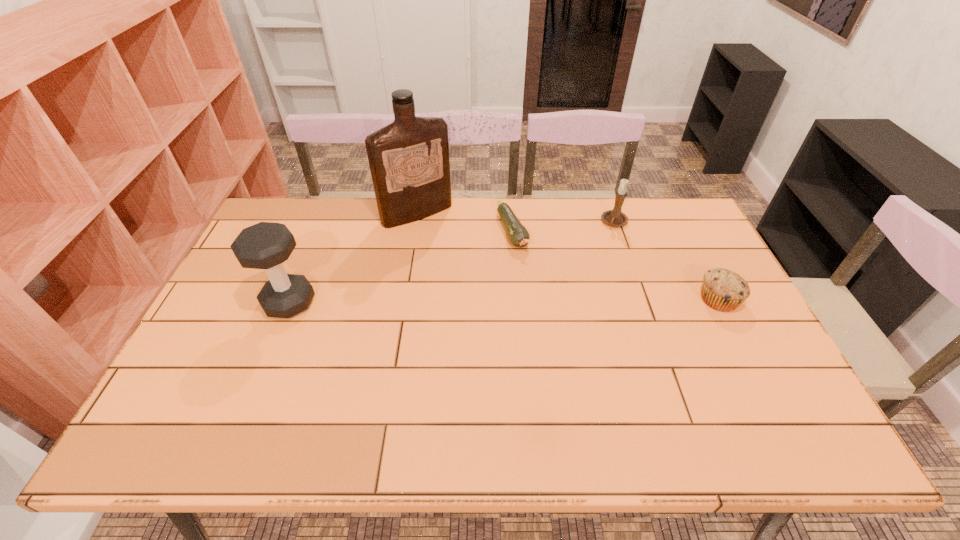
Locate an element on the screen. The image size is (960, 540). free space located 0.050m on the side of the candle holder with the handle is located at coordinates (605, 239).

You are a GUI agent. You are given a task and a screenshot of the screen. Output one action in this format:
    pyautogui.click(x=<x>, y=<y>)
    Task: Click on the liquor located at the far edge
    This screenshot has width=960, height=540.
    Given the screenshot: What is the action you would take?
    pyautogui.click(x=409, y=162)

Where is `zucchini that is at the far edge`? zucchini that is at the far edge is located at coordinates (518, 235).

Where is `candle holder at the far edge`? This screenshot has width=960, height=540. candle holder at the far edge is located at coordinates (615, 218).

In order to click on object present at the left edge in this screenshot , I will do `click(266, 245)`.

Where is `object located in the right edge section of the desktop`? object located in the right edge section of the desktop is located at coordinates 723,290.

Locate an element on the screen. Image resolution: width=960 pixels, height=540 pixels. blank space at the far edge of the desktop is located at coordinates [628, 231].

Where is `vacant region at the near edge of the desktop`? The width and height of the screenshot is (960, 540). vacant region at the near edge of the desktop is located at coordinates (400, 393).

Identify the location of free spot at the right edge of the desktop. (707, 351).

Locate an element on the screen. This screenshot has height=540, width=960. free space at the far left corner is located at coordinates (289, 210).